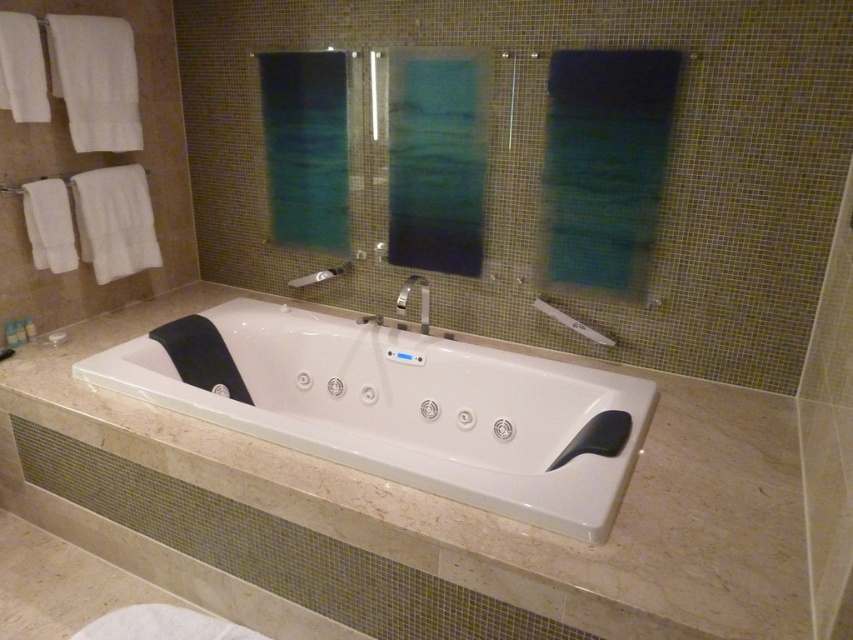
Can you confirm if white glossy bathtub at center is positioned above matte silver showerhead at center?

No, white glossy bathtub at center is not above matte silver showerhead at center.

This screenshot has height=640, width=853. In order to click on white glossy bathtub at center in this screenshot , I will do `click(399, 406)`.

The height and width of the screenshot is (640, 853). I want to click on white glossy bathtub at center, so click(399, 406).

Is silver metallic towel bar at upper center wider than matte silver showerhead at center?

No, silver metallic towel bar at upper center is not wider than matte silver showerhead at center.

Is silver metallic towel bar at upper center taller than matte silver showerhead at center?

Yes.

The image size is (853, 640). I want to click on silver metallic towel bar at upper center, so click(572, 323).

Can you confirm if white glossy bathtub at center is positioned to the left of silver metallic towel bar at upper center?

Correct, you'll find white glossy bathtub at center to the left of silver metallic towel bar at upper center.

What do you see at coordinates (399, 406) in the screenshot? I see `white glossy bathtub at center` at bounding box center [399, 406].

The height and width of the screenshot is (640, 853). In order to click on white glossy bathtub at center in this screenshot , I will do `click(399, 406)`.